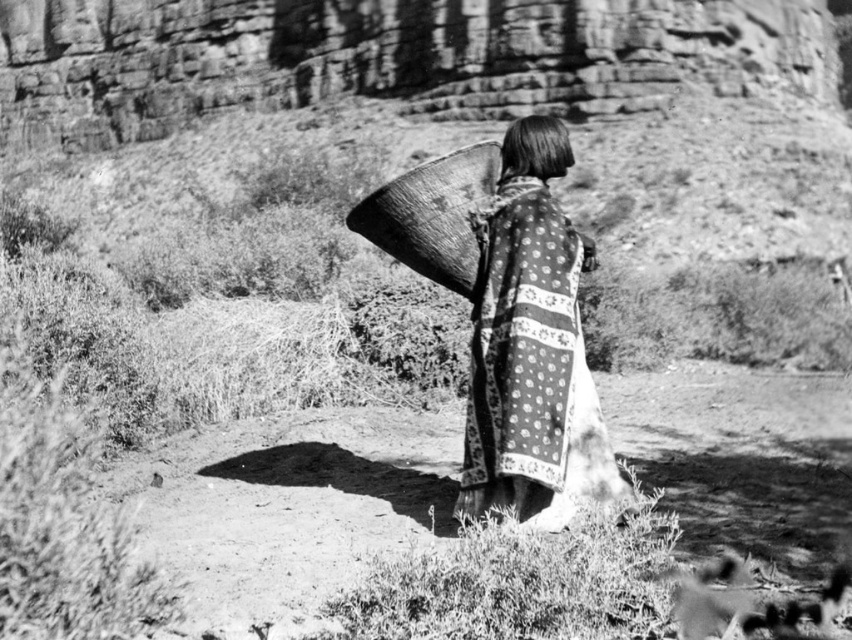
Question: Does patterned fabric shawl at center have a greater width compared to smooth dark hair at center?

Choices:
 (A) yes
 (B) no

Answer: (B)

Question: Which point is closer to the camera?

Choices:
 (A) (473, 253)
 (B) (521, 138)

Answer: (A)

Question: Which of these objects is positioned farthest from the smooth dark hair at center?

Choices:
 (A) wooden basket at upper center
 (B) patterned fabric shawl at center

Answer: (A)

Question: Which point is farther to the camera?

Choices:
 (A) (486, 435)
 (B) (533, 145)
 (C) (469, 214)

Answer: (B)

Question: Can you confirm if wooden basket at upper center is positioned above smooth dark hair at center?

Choices:
 (A) no
 (B) yes

Answer: (A)

Question: Is wooden basket at upper center positioned behind smooth dark hair at center?

Choices:
 (A) yes
 (B) no

Answer: (B)